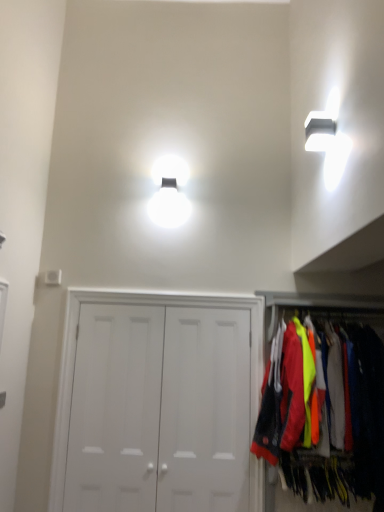
Question: From a real-world perspective, is white matte door at center, which appears as the first door when viewed from the right, beneath white matte door at center, the 2th door when ordered from right to left?

Choices:
 (A) yes
 (B) no

Answer: (A)

Question: Is white matte door at center, which appears as the first door when viewed from the right, looking in the opposite direction of white matte door at center, the 2th door when ordered from right to left?

Choices:
 (A) no
 (B) yes

Answer: (B)

Question: Can you confirm if white matte door at center, marked as the third door in a left-to-right arrangement, is shorter than white matte door at center, the second door positioned from the left?

Choices:
 (A) yes
 (B) no

Answer: (A)

Question: Is white matte door at center, marked as the third door in a left-to-right arrangement, completely or partially outside of white matte door at center, the second door positioned from the left?

Choices:
 (A) no
 (B) yes

Answer: (A)

Question: Does white matte door at center, which appears as the first door when viewed from the right, have a lesser width compared to white matte door at center, the second door positioned from the left?

Choices:
 (A) no
 (B) yes

Answer: (B)

Question: Considering the positions of neon yellow fabric at right and white matte door at center, the third door in the right-to-left sequence, in the image, is neon yellow fabric at right taller or shorter than white matte door at center, the third door in the right-to-left sequence,?

Choices:
 (A) tall
 (B) short

Answer: (B)

Question: From a real-world perspective, is neon yellow fabric at right positioned above or below white matte door at center, placed as the 1th door when sorted from left to right?

Choices:
 (A) below
 (B) above

Answer: (B)

Question: Is neon yellow fabric at right wider or thinner than white matte door at center, placed as the 1th door when sorted from left to right?

Choices:
 (A) wide
 (B) thin

Answer: (A)

Question: Is neon yellow fabric at right in front of or behind white matte door at center, placed as the 1th door when sorted from left to right, in the image?

Choices:
 (A) front
 (B) behind

Answer: (A)

Question: Considering the positions of white matte door at center, which appears as the first door when viewed from the right, and white matte door at center, placed as the 1th door when sorted from left to right, in the image, is white matte door at center, which appears as the first door when viewed from the right, bigger or smaller than white matte door at center, placed as the 1th door when sorted from left to right,?

Choices:
 (A) small
 (B) big

Answer: (A)

Question: Visually, is white matte door at center, marked as the third door in a left-to-right arrangement, positioned to the left or to the right of white matte door at center, the third door in the right-to-left sequence?

Choices:
 (A) right
 (B) left

Answer: (A)

Question: Considering their positions, is white matte door at center, which appears as the first door when viewed from the right, located in front of or behind white matte door at center, placed as the 1th door when sorted from left to right?

Choices:
 (A) front
 (B) behind

Answer: (A)

Question: From a real-world perspective, is white matte door at center, which appears as the first door when viewed from the right, above or below white matte door at center, the third door in the right-to-left sequence?

Choices:
 (A) above
 (B) below

Answer: (A)

Question: Looking at the image, does white matte door at center, the third door in the right-to-left sequence, seem bigger or smaller compared to white matte door at center, which appears as the first door when viewed from the right?

Choices:
 (A) small
 (B) big

Answer: (B)

Question: Does point (77, 373) appear closer or farther from the camera than point (165, 390)?

Choices:
 (A) closer
 (B) farther

Answer: (B)